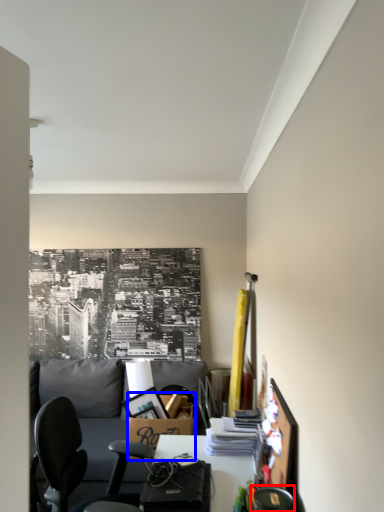
Question: Among these objects, which one is nearest to the camera, chair (highlighted by a red box) or box (highlighted by a blue box)?

Choices:
 (A) chair
 (B) box

Answer: (A)